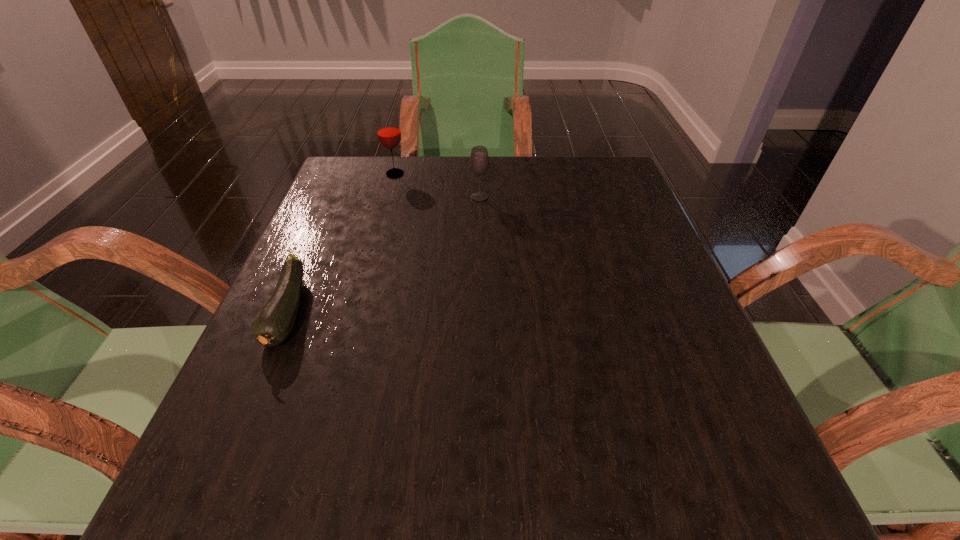
What are the coordinates of `the tallest object` in the screenshot? It's located at click(x=388, y=130).

You are a GUI agent. You are given a task and a screenshot of the screen. Output one action in this format:
    pyautogui.click(x=<x>, y=<y>)
    Task: Click on the second object from left to right
    This screenshot has height=540, width=960.
    Given the screenshot: What is the action you would take?
    pyautogui.click(x=388, y=130)

Where is `the second tallest object`? Image resolution: width=960 pixels, height=540 pixels. the second tallest object is located at coordinates (479, 160).

Where is `the rightmost object`? the rightmost object is located at coordinates (479, 160).

What are the coordinates of `the leftmost object` in the screenshot? It's located at (275, 322).

Locate an element on the screen. The width and height of the screenshot is (960, 540). the nearest object is located at coordinates (275, 322).

You are a GUI agent. You are given a task and a screenshot of the screen. Output one action in this format:
    pyautogui.click(x=<x>, y=<y>)
    Task: Click on the vacant space situated 0.390m on the right of the tallest object
    This screenshot has height=540, width=960.
    Given the screenshot: What is the action you would take?
    pyautogui.click(x=556, y=174)

Image resolution: width=960 pixels, height=540 pixels. Find the location of `vacant space located on the right of the nearer glass drink container`. vacant space located on the right of the nearer glass drink container is located at coordinates (592, 197).

This screenshot has height=540, width=960. Identify the location of vacant space located at the blossom end of the leftmost object. (x=231, y=447).

The width and height of the screenshot is (960, 540). I want to click on glass present at the left edge, so click(x=388, y=130).